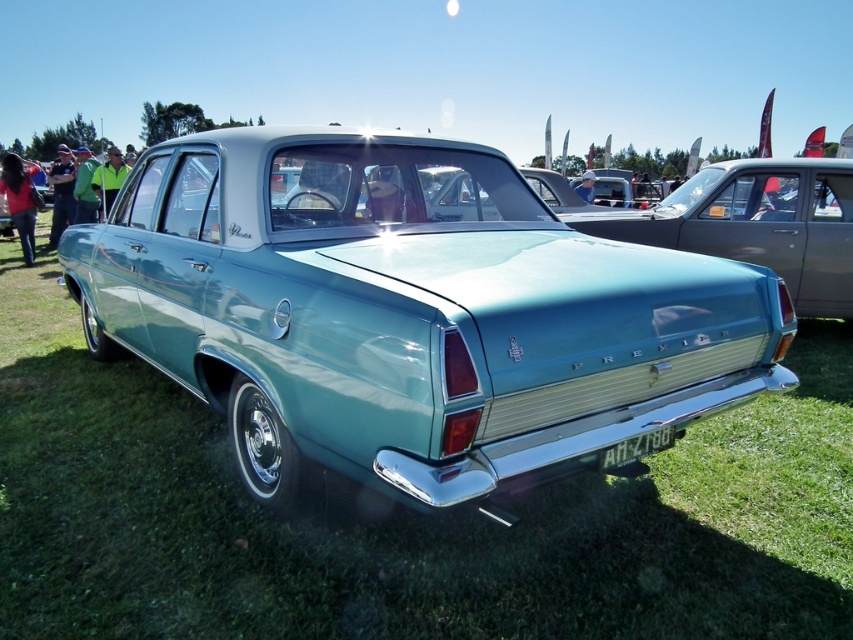
You are standing in front of the vintage Holden Premier parked on the grassy field. You notice two points marked on the car. The first point is at coordinate (608, 240) and the second at (618, 456). From your perspective, which point is closer to you?

Point (608, 240) is closer to you because it is further to the camera than point (618, 456).

You are a photographer trying to capture the white plastic license plate at center of the Holden Premier. However, the teal glossy sedan at center is blocking your view. Can you still see the license plate?

The teal glossy sedan at center is positioned over the white plastic license plate at center, so the license plate is completely blocked and cannot be seen.

You are standing at the point marked as point (697,272) near the vintage Holden Premier. You want to throw a ball to your friend who is standing 3 meters away from you. Can you reach your friend by throwing the ball from your current position?

The distance between you and your friend is exactly 2.93 meters, so yes, you can reach your friend by throwing the ball from your current position at point (697,272).